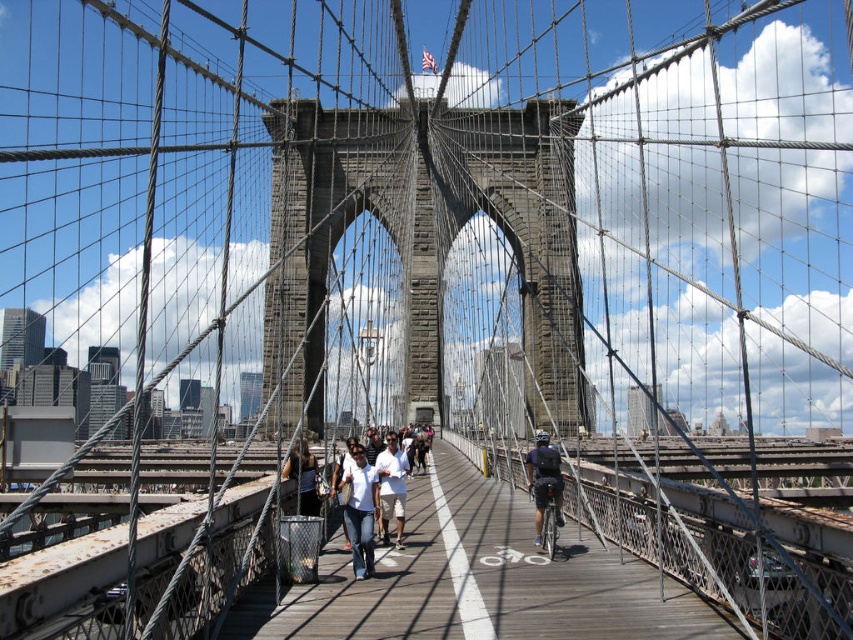
Question: Can you confirm if wooden walkway at center is positioned to the right of dark blue jeans at center?

Choices:
 (A) no
 (B) yes

Answer: (A)

Question: In this image, where is denim pants at center located relative to dark blue jeans at center?

Choices:
 (A) above
 (B) below

Answer: (B)

Question: Which of the following is the farthest from the observer?

Choices:
 (A) dark blue jeans at center
 (B) denim pants at center
 (C) wooden walkway at center

Answer: (A)

Question: Which point is farther to the camera?

Choices:
 (A) dark blue jeans at center
 (B) wooden walkway at center
 (C) white cotton shirt at center
 (D) denim pants at center

Answer: (C)

Question: Which point is closer to the camera?

Choices:
 (A) (538, 448)
 (B) (386, 541)
 (C) (364, 568)

Answer: (C)

Question: Is wooden walkway at center below denim pants at center?

Choices:
 (A) yes
 (B) no

Answer: (A)